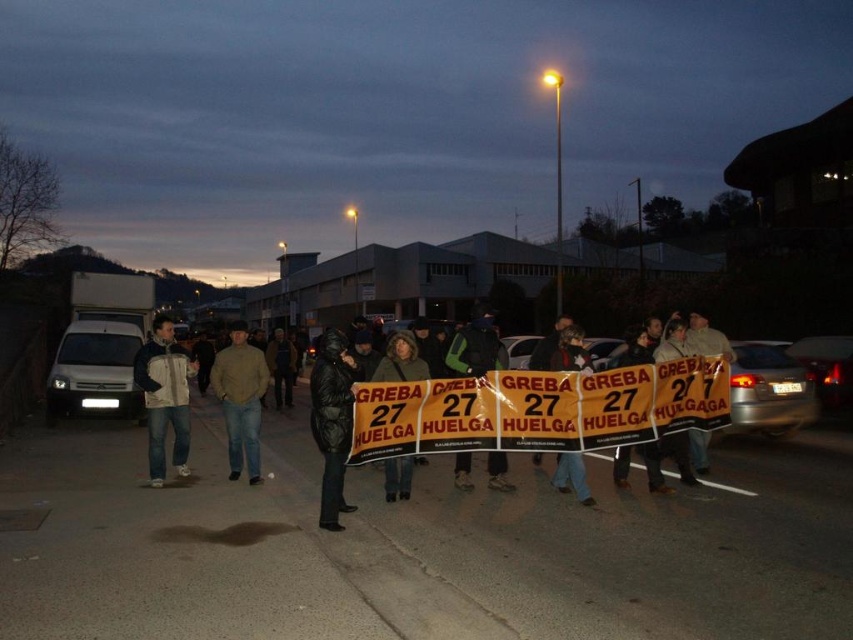
Question: Is light brown sweater at center thinner than dark green jacket at center?

Choices:
 (A) yes
 (B) no

Answer: (B)

Question: Which object is positioned farthest from the white fleece jacket at left?

Choices:
 (A) black jacket at center
 (B) dark green jacket at center

Answer: (A)

Question: Is black puffy coat at center to the left of light brown sweater at center from the viewer's perspective?

Choices:
 (A) yes
 (B) no

Answer: (B)

Question: Which object appears farthest from the camera in this image?

Choices:
 (A) yellow fabric banner at center
 (B) white fleece jacket at left
 (C) black jacket at center
 (D) black puffy coat at center

Answer: (B)

Question: Which of the following is the closest to the observer?

Choices:
 (A) white fleece jacket at left
 (B) yellow fabric banner at center
 (C) black matte jacket at center
 (D) black puffy coat at center

Answer: (D)

Question: Does black puffy coat at center appear on the right side of dark green jacket at center?

Choices:
 (A) no
 (B) yes

Answer: (A)